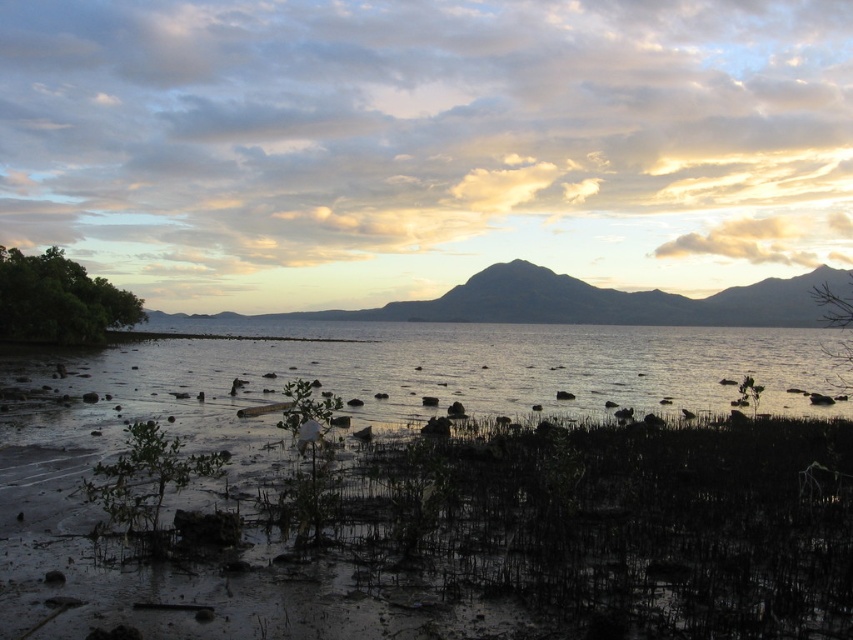
Question: Is clear water at center thinner than smooth gray mountain at center?

Choices:
 (A) yes
 (B) no

Answer: (A)

Question: Which point is farther to the camera?

Choices:
 (A) smooth gray mountain at center
 (B) clear water at center

Answer: (A)

Question: Is clear water at center bigger than smooth gray mountain at center?

Choices:
 (A) yes
 (B) no

Answer: (B)

Question: Does clear water at center appear under smooth gray mountain at center?

Choices:
 (A) no
 (B) yes

Answer: (B)